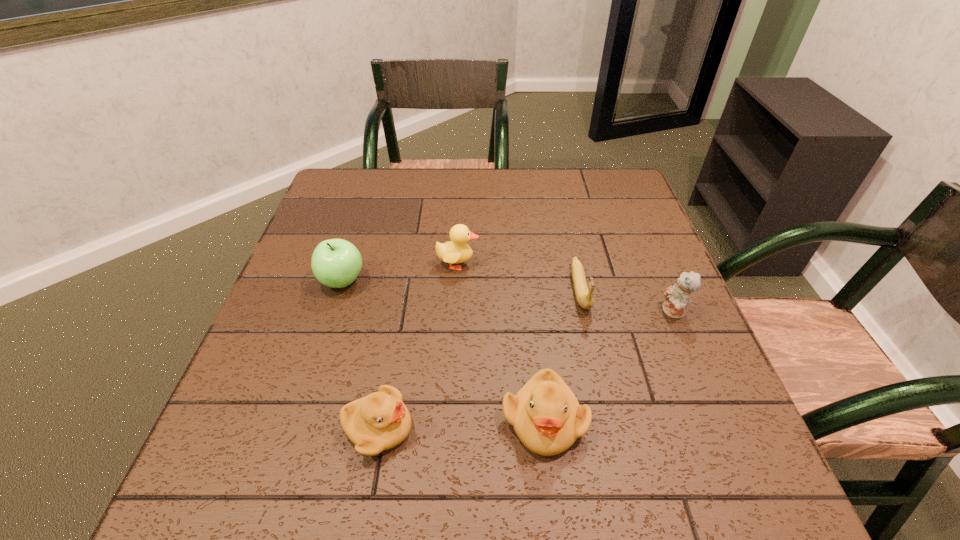
Locate an element on the screen. The image size is (960, 540). vacant space at the right edge of the desktop is located at coordinates (648, 266).

Find the location of a particular element. This screenshot has width=960, height=540. free space at the far left corner of the desktop is located at coordinates (337, 171).

This screenshot has height=540, width=960. Find the location of `vacant region at the far right corner`. vacant region at the far right corner is located at coordinates (619, 177).

Identify the location of free region at the near right corner of the desktop. (710, 422).

Image resolution: width=960 pixels, height=540 pixels. I want to click on vacant region between the farthest duckling and the teddy bear, so click(565, 288).

Locate an element on the screen. free space between the teddy bear and the fourth object from right to left is located at coordinates (565, 288).

Identify the location of free area in between the rightmost duckling and the leftmost duckling. Image resolution: width=960 pixels, height=540 pixels. (461, 424).

Locate an element on the screen. This screenshot has width=960, height=540. empty space between the apple and the banana is located at coordinates (461, 285).

Locate an element on the screen. This screenshot has width=960, height=540. free space between the third object from right to left and the fifth object from right to left is located at coordinates pos(461,424).

This screenshot has width=960, height=540. What are the coordinates of `vacant space in between the second duckling from right to left and the leftmost duckling` in the screenshot? It's located at (418, 346).